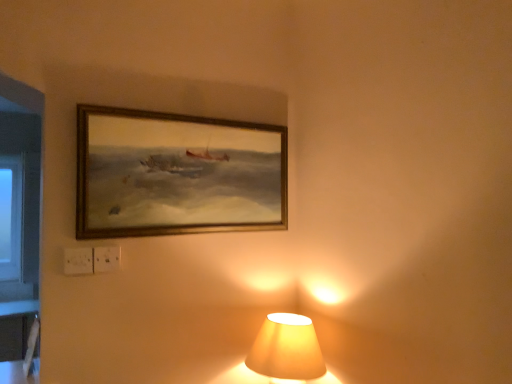
Question: Which direction should I rotate to look at matte yellow fabric lampshade at lower center?

Choices:
 (A) left
 (B) right

Answer: (B)

Question: Does wooden frame at upper center have a larger size compared to matte yellow fabric lampshade at lower center?

Choices:
 (A) yes
 (B) no

Answer: (B)

Question: Is wooden frame at upper center completely or partially outside of matte yellow fabric lampshade at lower center?

Choices:
 (A) no
 (B) yes

Answer: (B)

Question: Can you confirm if wooden frame at upper center is wider than matte yellow fabric lampshade at lower center?

Choices:
 (A) no
 (B) yes

Answer: (A)

Question: Is wooden frame at upper center oriented towards matte yellow fabric lampshade at lower center?

Choices:
 (A) no
 (B) yes

Answer: (A)

Question: Can you confirm if wooden frame at upper center is positioned to the right of matte yellow fabric lampshade at lower center?

Choices:
 (A) yes
 (B) no

Answer: (B)

Question: Is wooden frame at upper center in contact with matte yellow fabric lampshade at lower center?

Choices:
 (A) yes
 (B) no

Answer: (B)

Question: Is matte yellow fabric lampshade at lower center at the right side of wooden frame at upper center?

Choices:
 (A) no
 (B) yes

Answer: (B)

Question: Is matte yellow fabric lampshade at lower center oriented away from wooden frame at upper center?

Choices:
 (A) yes
 (B) no

Answer: (B)

Question: Is wooden frame at upper center surrounded by matte yellow fabric lampshade at lower center?

Choices:
 (A) yes
 (B) no

Answer: (B)

Question: Can you confirm if matte yellow fabric lampshade at lower center is shorter than wooden frame at upper center?

Choices:
 (A) no
 (B) yes

Answer: (B)

Question: From the image's perspective, would you say matte yellow fabric lampshade at lower center is positioned over wooden frame at upper center?

Choices:
 (A) yes
 (B) no

Answer: (B)

Question: Is matte yellow fabric lampshade at lower center not within wooden frame at upper center?

Choices:
 (A) no
 (B) yes

Answer: (B)

Question: Would you say wooden frame at upper center is to the left or to the right of matte yellow fabric lampshade at lower center in the picture?

Choices:
 (A) left
 (B) right

Answer: (A)